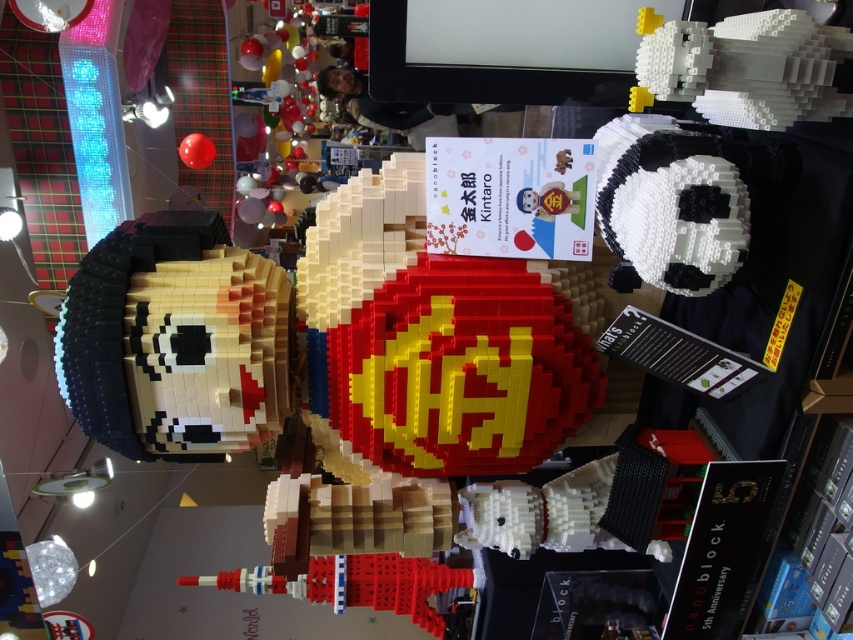
Which is more to the right, white matte lego chicken at upper right or matte black panda at upper right?

Positioned to the right is white matte lego chicken at upper right.

What are the coordinates of `white matte lego chicken at upper right` in the screenshot? It's located at (747, 68).

Locate an element on the screen. white matte lego chicken at upper right is located at coordinates point(747,68).

Consider the image. Between black matte panda head at upper right and white matte lego chicken at upper right, which one is positioned lower?

black matte panda head at upper right

Who is taller, black matte panda head at upper right or white matte lego chicken at upper right?

black matte panda head at upper right

Does point (659, 144) come in front of point (770, 67)?

No, (659, 144) is behind (770, 67).

At what (x,y) coordinates should I click in order to perform the action: click on black matte panda head at upper right. Please return your answer as a coordinate pair (x, y). Looking at the image, I should click on (670, 204).

Can you confirm if brick-like face at left is wider than matte black panda at upper right?

No.

Find the location of a particular element. brick-like face at left is located at coordinates (177, 340).